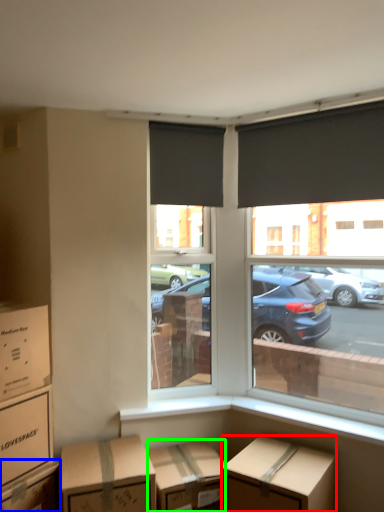
Question: Which object is the farthest from box (highlighted by a red box)? Choose among these: box (highlighted by a blue box) or cardboard box (highlighted by a green box).

Choices:
 (A) box
 (B) cardboard box

Answer: (A)